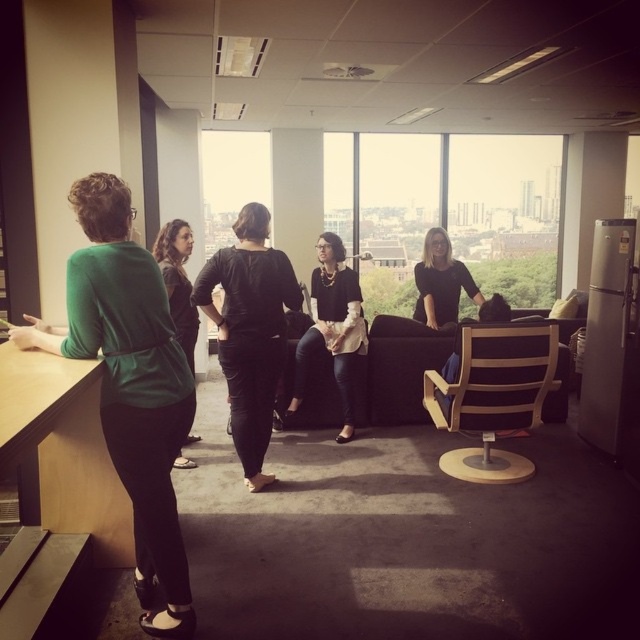
Question: Considering the relative positions of green matte blouse at left and matte black shirt at center in the image provided, where is green matte blouse at left located with respect to matte black shirt at center?

Choices:
 (A) left
 (B) right

Answer: (A)

Question: Which is farther from the green matte blouse at left?

Choices:
 (A) matte black blouse at center
 (B) matte black shirt at center
 (C) black matte/black pants at center

Answer: (B)

Question: Which of the following is the closest to the observer?

Choices:
 (A) (152, 502)
 (B) (184, 221)
 (C) (353, 387)

Answer: (A)

Question: Observing the image, what is the correct spatial positioning of matte black blouse at center in reference to matte black shirt at center?

Choices:
 (A) left
 (B) right

Answer: (A)

Question: Estimate the real-world distances between objects in this image. Which object is farther from the matte black blouse at center?

Choices:
 (A) matte black shirt at center
 (B) black matte/black pants at center
 (C) green matte blouse at left
 (D) matte green sweater at left

Answer: (C)

Question: Observing the image, what is the correct spatial positioning of green matte blouse at left in reference to black matte/black pants at center?

Choices:
 (A) left
 (B) right

Answer: (A)